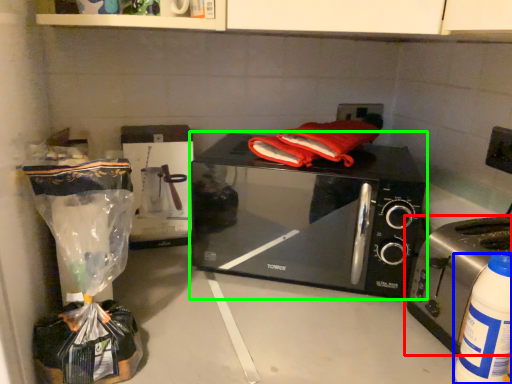
Question: Considering the real-world distances, which object is farthest from toaster (highlighted by a red box)? bottle (highlighted by a blue box) or microwave oven (highlighted by a green box)?

Choices:
 (A) bottle
 (B) microwave oven

Answer: (B)